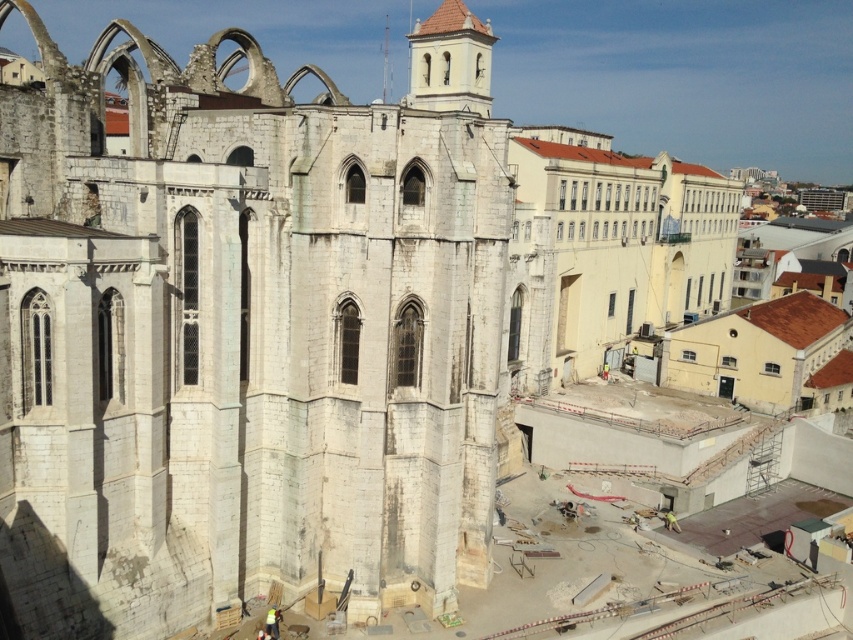
You are a construction worker standing at the entrance of the site. You need to move a heavy beam from the white stone ruins at center to the smooth beige tower at center. Which direction should you move the beam to reach the tower?

The white stone ruins at center is to the left of smooth beige tower at center, so you should move the beam to the right to reach the tower.

You are a construction supervisor assessing the site. You notice the white stone ruins at center and the smooth beige tower at center. Which of these two structures takes up more area in the image?

The smooth beige tower at center occupies more space than the white stone ruins at center, so it takes up more area in the image.

You are a construction worker who needs to move a heavy equipment from the white stone ruins at center to the smooth beige tower at center. The equipment requires a path that is at least 50 meters long. Can you use the path between them?

The distance between the white stone ruins at center and the smooth beige tower at center is 54.09 meters, which is longer than the required 50 meters. Therefore, the path between them is suitable for moving the heavy equipment.